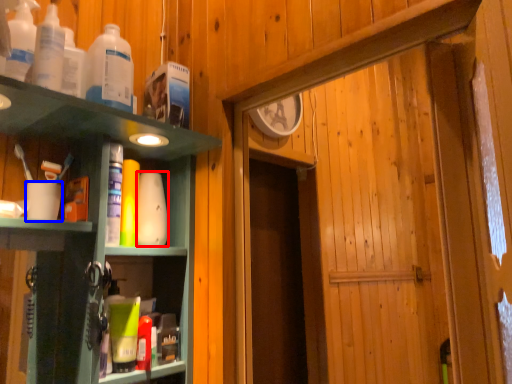
Question: Which point is closer to the camera, toiletry (highlighted by a red box) or coffee cup (highlighted by a blue box)?

Choices:
 (A) toiletry
 (B) coffee cup

Answer: (B)